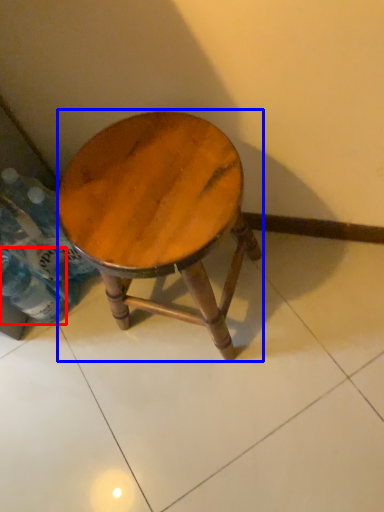
Question: Which object appears farthest to the camera in this image, bottle (highlighted by a red box) or stool (highlighted by a blue box)?

Choices:
 (A) bottle
 (B) stool

Answer: (A)